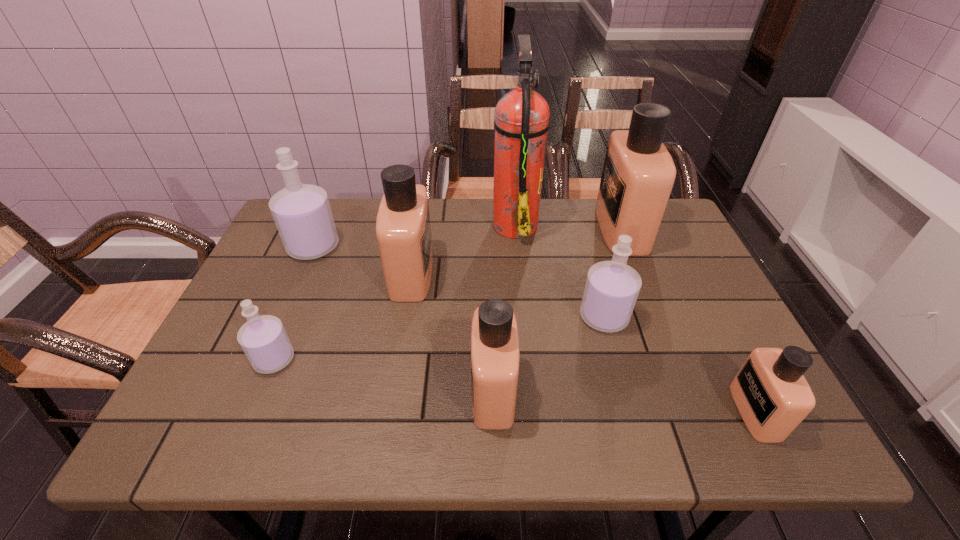
At what (x,y) coordinates should I click in order to perform the action: click on object that is at the far left corner. Please return your answer as a coordinate pair (x, y). The image size is (960, 540). Looking at the image, I should click on (302, 214).

Where is `object that is at the far right corner`? The image size is (960, 540). object that is at the far right corner is located at coordinates (638, 174).

This screenshot has width=960, height=540. Identify the location of object that is at the near right corner. (773, 397).

Locate an element on the screen. Image resolution: width=960 pixels, height=540 pixels. vacant space at the far edge is located at coordinates (445, 234).

Image resolution: width=960 pixels, height=540 pixels. What are the coordinates of `blank space at the near edge of the desktop` in the screenshot? It's located at (636, 443).

The image size is (960, 540). In the image, there is a desktop. Find the location of `free space at the left edge`. free space at the left edge is located at coordinates (262, 395).

I want to click on blank area at the right edge, so click(646, 261).

I want to click on vacant space at the far left corner of the desktop, so click(336, 201).

In order to click on blank space at the near left corner of the desktop in this screenshot , I will do `click(183, 431)`.

Locate an element on the screen. blank space at the far right corner of the desktop is located at coordinates (675, 230).